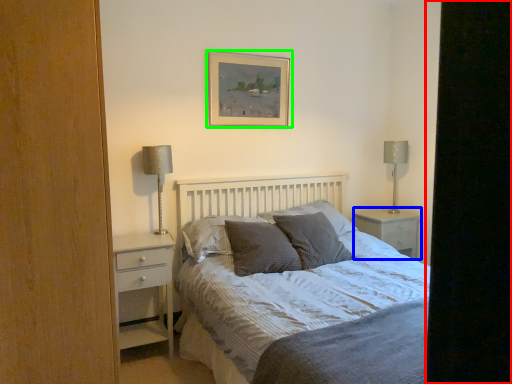
Question: Considering the real-world distances, which object is closest to screen door (highlighted by a red box)? nightstand (highlighted by a blue box) or picture frame (highlighted by a green box).

Choices:
 (A) nightstand
 (B) picture frame

Answer: (B)